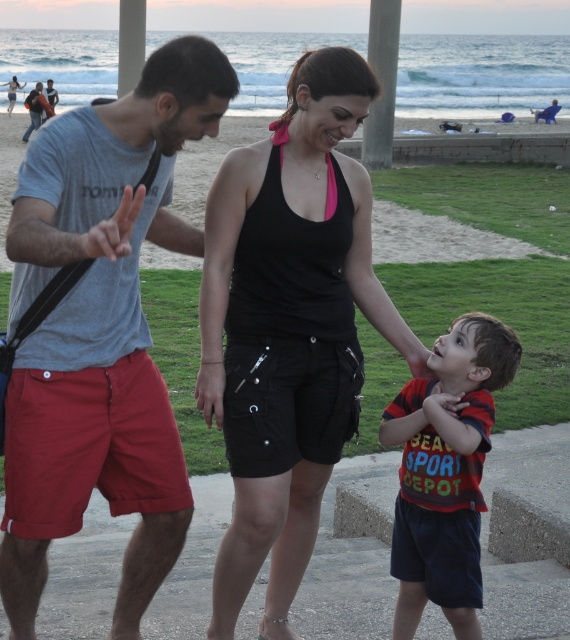
Based on the scene description, which clothing item is positioned higher on the person wearing both the black cotton tank top at center and the striped cotton shirt at center?

The black cotton tank top at center is located above the striped cotton shirt at center, so it is positioned higher.